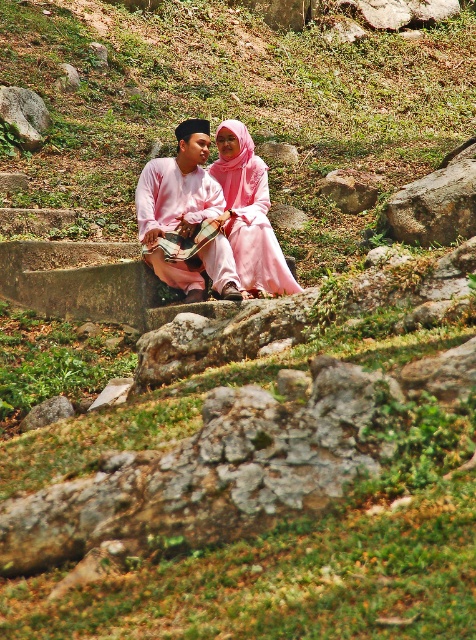
This screenshot has width=476, height=640. In order to click on matte pink clothing at center in this screenshot , I will do `click(185, 214)`.

Which is in front, point (148, 177) or point (231, 188)?

Point (148, 177)

Measure the distance between point (177,221) and camera.

Point (177,221) is 42.82 feet from camera.

Where is `matte pink clothing at center`? matte pink clothing at center is located at coordinates (185, 214).

Does matte pink clothing at center appear on the left side of gray rough rock at upper left?

No, matte pink clothing at center is not to the left of gray rough rock at upper left.

Identify the location of matte pink clothing at center. The width and height of the screenshot is (476, 640). (185, 214).

Between matte pink clothing at center and smooth gray rock at center, which one appears on the right side from the viewer's perspective?

smooth gray rock at center is more to the right.

Who is more distant from viewer, (x=186, y=198) or (x=344, y=173)?

The point (x=344, y=173) is behind.

The height and width of the screenshot is (640, 476). What are the coordinates of `matte pink clothing at center` in the screenshot? It's located at (185, 214).